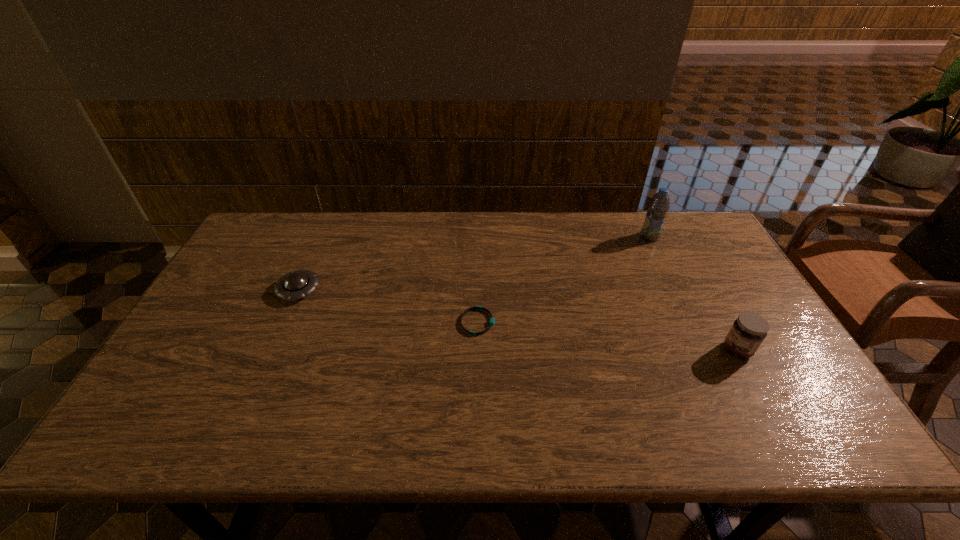
This screenshot has width=960, height=540. In order to click on vacant point located 0.170m on the front label of the jam in this screenshot , I will do `click(657, 350)`.

You are a GUI agent. You are given a task and a screenshot of the screen. Output one action in this format:
    pyautogui.click(x=<x>, y=<y>)
    Task: Click on the free space located 0.260m on the front label of the jam
    The height and width of the screenshot is (540, 960).
    Given the screenshot: What is the action you would take?
    pyautogui.click(x=622, y=350)

Where is `free space located on the front of the saucer`? The image size is (960, 540). free space located on the front of the saucer is located at coordinates (282, 327).

Find the location of a particular element. The width and height of the screenshot is (960, 540). vacant position located 0.390m on the buckle of the third object from right to left is located at coordinates (637, 322).

Locate an element on the screen. object situated at the far edge is located at coordinates (658, 206).

The width and height of the screenshot is (960, 540). I want to click on object located at the right edge, so click(749, 330).

I want to click on vacant space at the far edge, so click(x=560, y=212).

At what (x,y) coordinates should I click in order to perform the action: click on free space at the near edge. Please return your answer as a coordinate pair (x, y). This screenshot has width=960, height=540. Looking at the image, I should click on (614, 445).

Where is `free region at the left edge of the desktop`? free region at the left edge of the desktop is located at coordinates (274, 280).

At what (x,y) coordinates should I click in order to perform the action: click on blank space at the right edge of the desktop. Please return your answer as a coordinate pair (x, y). Looking at the image, I should click on (773, 381).